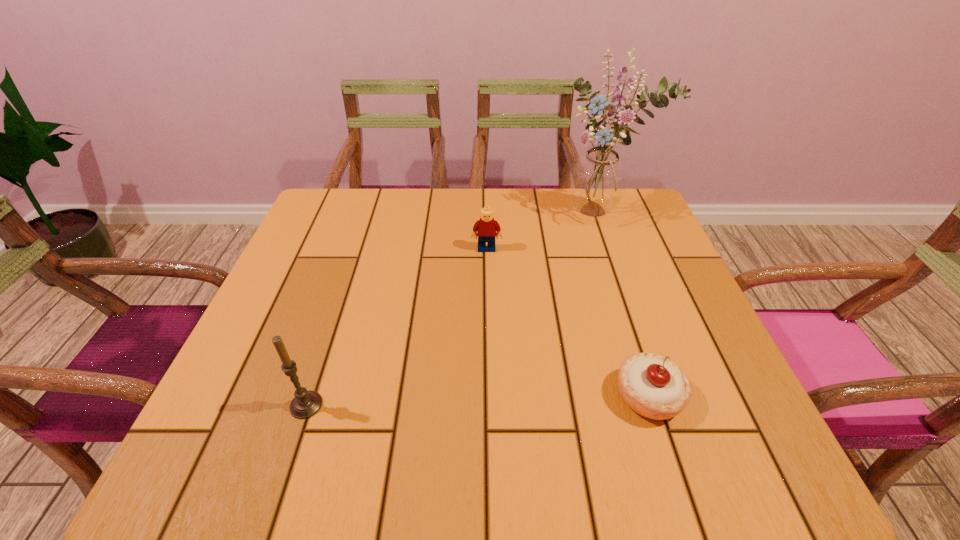
Locate which object ranks in proximity to the shortest object. Please provide its 2D coordinates. Your answer should be formatted as a tuple, i.e. [(x, y)], where the tuple contains the x and y coordinates of a point satisfying the conditions above.

[(485, 228)]

At what (x,y) coordinates should I click in order to perform the action: click on blank area in the image that satisfies the following two spatial constraints: 1. on the back side of the bouquet; 2. on the right side of the third nearest object. Please return your answer as a coordinate pair (x, y). This screenshot has width=960, height=540. Looking at the image, I should click on (486, 210).

The image size is (960, 540). What are the coordinates of `free spot that satisfies the following two spatial constraints: 1. on the back side of the second tallest object; 2. on the right side of the third nearest object` in the screenshot? It's located at (358, 249).

Locate an element on the screen. This screenshot has height=540, width=960. free spot that satisfies the following two spatial constraints: 1. on the back side of the second object from left to right; 2. on the left side of the tallest object is located at coordinates (486, 210).

What are the coordinates of `vacant point that satisfies the following two spatial constraints: 1. on the back side of the farthest object; 2. on the right side of the leftmost object` in the screenshot? It's located at (371, 210).